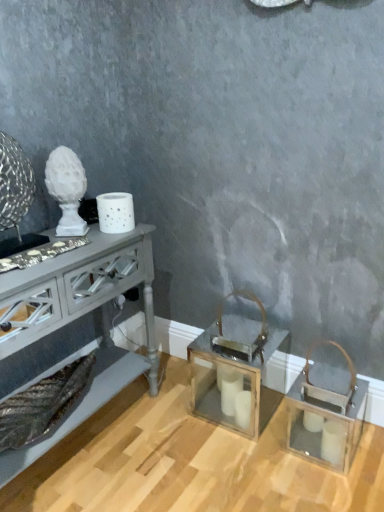
Question: In terms of size, does clear glass lantern at center, the 2th table in the left-to-right sequence, appear bigger or smaller than matte gray console table at left, which is the first table in left-to-right order?

Choices:
 (A) small
 (B) big

Answer: (A)

Question: In terms of width, does clear glass lantern at center, the 1th table positioned from the right, look wider or thinner when compared to matte gray console table at left, which is the first table in left-to-right order?

Choices:
 (A) wide
 (B) thin

Answer: (B)

Question: From a real-world perspective, is clear glass lantern at center, the 2th table in the left-to-right sequence, above or below matte gray console table at left, which is the first table in left-to-right order?

Choices:
 (A) below
 (B) above

Answer: (A)

Question: Based on their sizes in the image, would you say matte gray console table at left, acting as the second table starting from the right, is bigger or smaller than clear glass lantern at center, the 1th table positioned from the right?

Choices:
 (A) big
 (B) small

Answer: (A)

Question: From a real-world perspective, is matte gray console table at left, acting as the second table starting from the right, above or below clear glass lantern at center, the 1th table positioned from the right?

Choices:
 (A) below
 (B) above

Answer: (B)

Question: From the image's perspective, is matte gray console table at left, acting as the second table starting from the right, located above or below clear glass lantern at center, the 1th table positioned from the right?

Choices:
 (A) above
 (B) below

Answer: (A)

Question: Considering the positions of point (132, 262) and point (271, 337), is point (132, 262) closer or farther from the camera than point (271, 337)?

Choices:
 (A) closer
 (B) farther

Answer: (A)